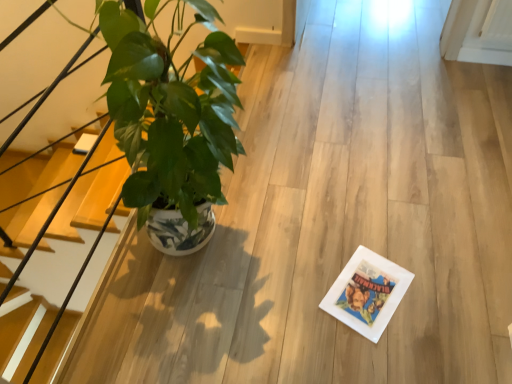
Find the location of a particular element. vacant area located to the right-hand side of wooden at left is located at coordinates (273, 278).